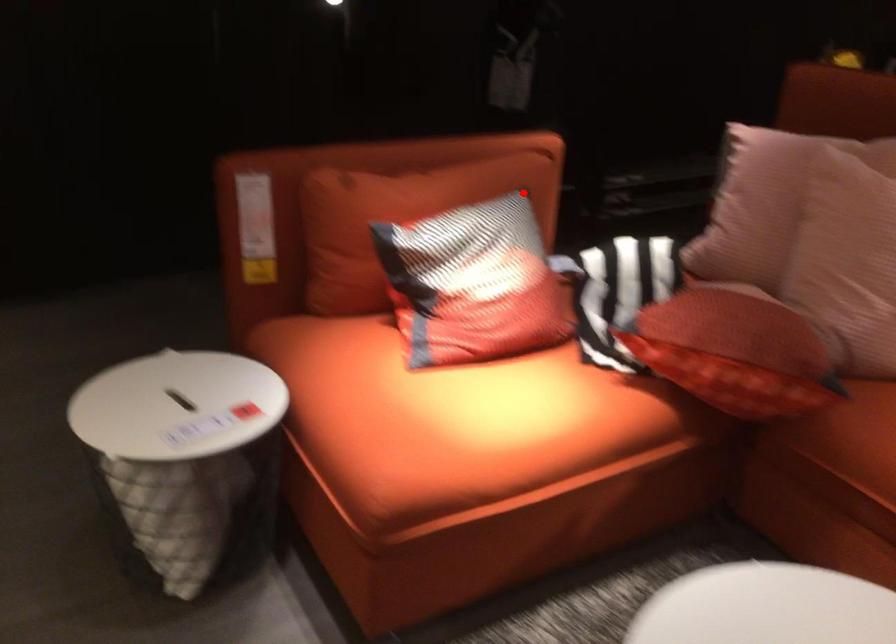
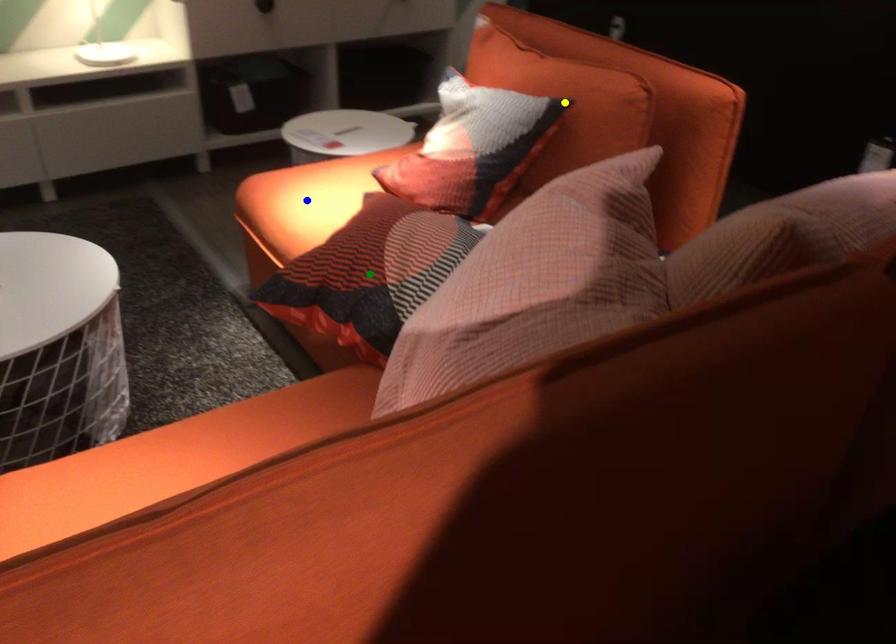
Question: I am providing you with two images of the same scene from different viewpoints. A red point is marked on the first image. You are given multiple points on the second image. In image 2, which mark is for the same physical point as the one in image 1?

Choices:
 (A) yellow point
 (B) blue point
 (C) green point

Answer: (A)